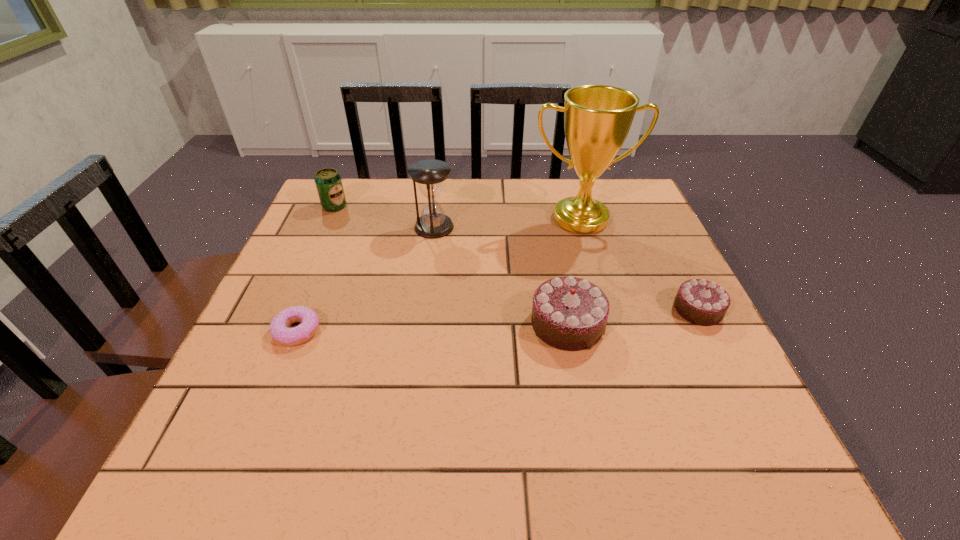
Where is `the left chocolate cake`? the left chocolate cake is located at coordinates (568, 313).

Image resolution: width=960 pixels, height=540 pixels. Find the location of `the right chocolate cake`. the right chocolate cake is located at coordinates (699, 301).

Locate an element on the screen. the rightmost object is located at coordinates (699, 301).

This screenshot has height=540, width=960. I want to click on beer can, so click(328, 182).

At what (x,y) coordinates should I click in order to perform the action: click on award. Please return your answer as a coordinate pair (x, y). Image resolution: width=960 pixels, height=540 pixels. Looking at the image, I should click on (597, 118).

Image resolution: width=960 pixels, height=540 pixels. I want to click on the shortest object, so click(279, 330).

Where is `the third object from left to right`? The height and width of the screenshot is (540, 960). the third object from left to right is located at coordinates (429, 174).

Image resolution: width=960 pixels, height=540 pixels. What are the coordinates of `the fifth shortest object` in the screenshot? It's located at (429, 174).

What are the coordinates of `vacant region located on the left of the left chocolate cake` in the screenshot? It's located at (374, 324).

Image resolution: width=960 pixels, height=540 pixels. I want to click on vacant region located on the back of the shorter chocolate cake, so [x=645, y=206].